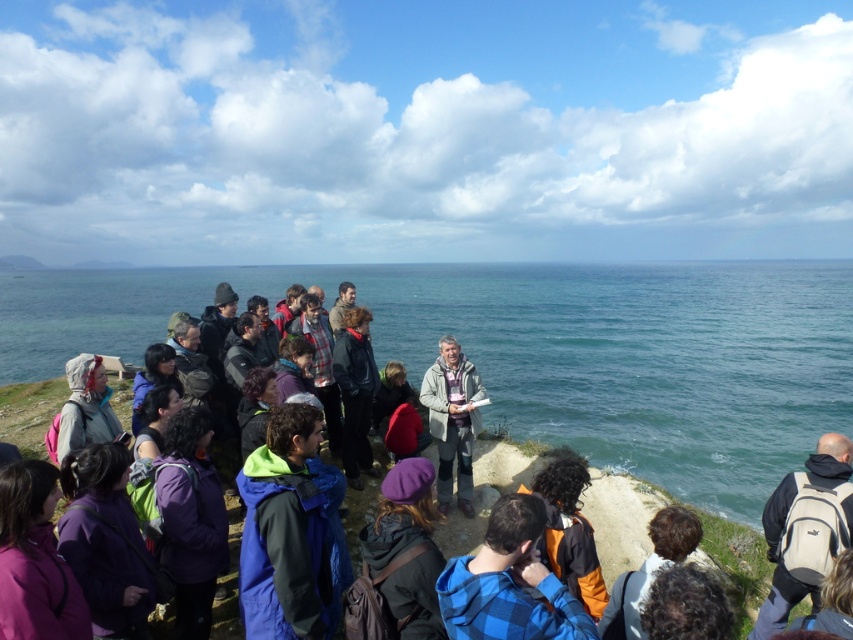
Does blue checkered shirt at lower center come in front of matte gray jacket at lower left?

That is True.

Who is positioned more to the right, blue checkered shirt at lower center or matte gray jacket at lower left?

blue checkered shirt at lower center

Does point (529, 605) lie in front of point (67, 420)?

Yes, it is in front of point (67, 420).

This screenshot has height=640, width=853. I want to click on blue checkered shirt at lower center, so [509, 582].

Is point (646, 440) farther from camera compared to point (299, 436)?

Yes.

Where is `blue water at center`? blue water at center is located at coordinates (543, 349).

Can you confirm if purple fleece jacket at lower left is thinner than brown woolen hat at lower right?

Indeed, purple fleece jacket at lower left has a lesser width compared to brown woolen hat at lower right.

What do you see at coordinates (33, 560) in the screenshot? The height and width of the screenshot is (640, 853). I see `purple fleece jacket at lower left` at bounding box center [33, 560].

Is point (49, 512) positioned in front of point (697, 538)?

Yes, it is in front of point (697, 538).

The height and width of the screenshot is (640, 853). Find the location of `purple fleece jacket at lower left`. purple fleece jacket at lower left is located at coordinates (33, 560).